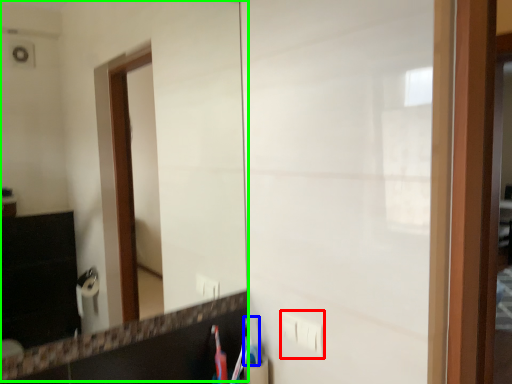
Question: Which object is positioned closest to electric outlet (highlighted by a red box)? Select from toothbrush (highlighted by a blue box) and mirror (highlighted by a green box).

Choices:
 (A) toothbrush
 (B) mirror

Answer: (A)